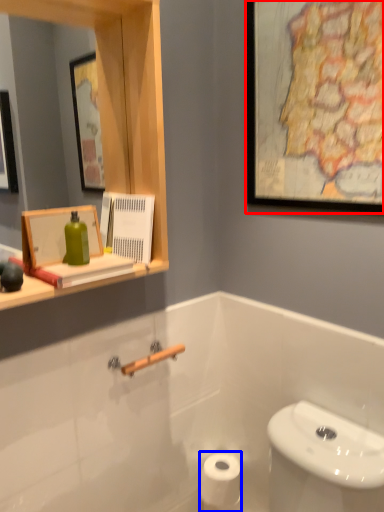
Question: Which of the following is the farthest to the observer, picture frame (highlighted by a red box) or toilet paper (highlighted by a blue box)?

Choices:
 (A) picture frame
 (B) toilet paper

Answer: (B)